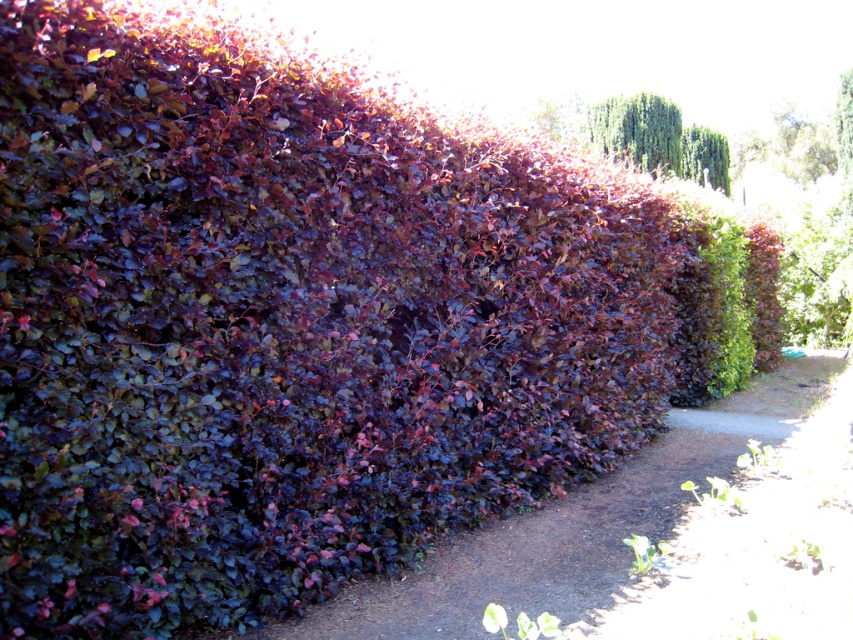
Question: Which object is farther from the camera taking this photo?

Choices:
 (A) purple leafy hedge at center
 (B) green leafy plant at lower right

Answer: (A)

Question: Where is green textured tree at upper center located in relation to green leafy plant at lower right in the image?

Choices:
 (A) left
 (B) right

Answer: (B)

Question: Which of the following is the farthest from the observer?

Choices:
 (A) (831, 522)
 (B) (646, 556)
 (C) (654, 116)

Answer: (C)

Question: Where is purple leafy hedge at center located in relation to green leafy plant at lower right in the image?

Choices:
 (A) above
 (B) below

Answer: (B)

Question: In this image, where is purple leafy hedge at center located relative to green textured tree at upper center?

Choices:
 (A) above
 (B) below

Answer: (B)

Question: Which point appears closest to the camera in this image?

Choices:
 (A) (645, 120)
 (B) (618, 593)
 (C) (643, 554)

Answer: (B)